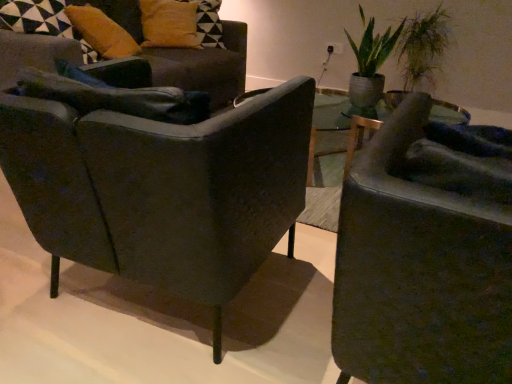
Question: Relative to matte black armchair at right, arranged as the 3th chair when viewed from the back, is green leafy plant at upper right in front or behind?

Choices:
 (A) front
 (B) behind

Answer: (B)

Question: From their relative heights in the image, would you say green leafy plant at upper right is taller or shorter than matte black armchair at right, the first chair positioned from the front?

Choices:
 (A) tall
 (B) short

Answer: (B)

Question: Considering the real-world distances, which object is closest to the matte black armchair at left, acting as the 2th chair starting from the back?

Choices:
 (A) green leafy plant at upper right
 (B) mustard yellow fabric pillow at upper left, arranged as the 2th pillow when viewed from the back
 (C) matte yellow pillow at upper left, marked as the 1th pillow in a back-to-front arrangement
 (D) green leafy plant at upper right
 (E) matte black armchair at right, arranged as the 3th chair when viewed from the back

Answer: (E)

Question: Which object is the farthest from the matte black armchair at right, arranged as the 3th chair when viewed from the back?

Choices:
 (A) matte yellow pillow at upper left, marked as the 1th pillow in a back-to-front arrangement
 (B) matte black armchair at left, the second chair from the front
 (C) green leafy plant at upper right
 (D) mustard yellow fabric pillow at upper left, arranged as the 2th pillow when viewed from the back
 (E) green leafy plant at upper right

Answer: (C)